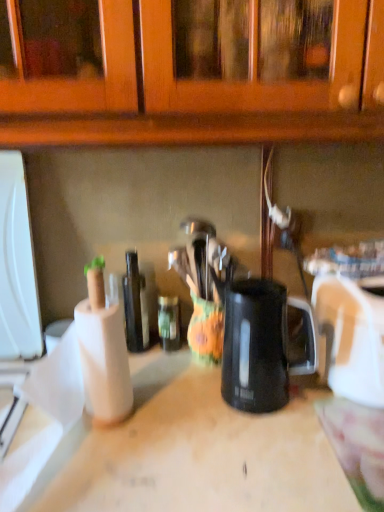
Question: From the image's perspective, is shiny dark glass bottle at center, which is the first bottle from left to right, positioned above or below black plastic mug at center?

Choices:
 (A) above
 (B) below

Answer: (A)

Question: Choose the correct answer: Is shiny dark glass bottle at center, positioned as the second bottle in right-to-left order, inside black plastic mug at center or outside it?

Choices:
 (A) outside
 (B) inside

Answer: (A)

Question: Which of these objects is positioned closest to the shiny dark glass bottle at center, which is the first bottle from left to right?

Choices:
 (A) white plastic toaster at right
 (B) wooden at center
 (C) green glass bottle at center, which is the 2th bottle in left-to-right order
 (D) black plastic mug at center

Answer: (C)

Question: Which is farther from the black plastic mug at center?

Choices:
 (A) wooden at center
 (B) white plastic toaster at right
 (C) shiny dark glass bottle at center, positioned as the second bottle in right-to-left order
 (D) green glass bottle at center, which is the 2th bottle in left-to-right order

Answer: (C)